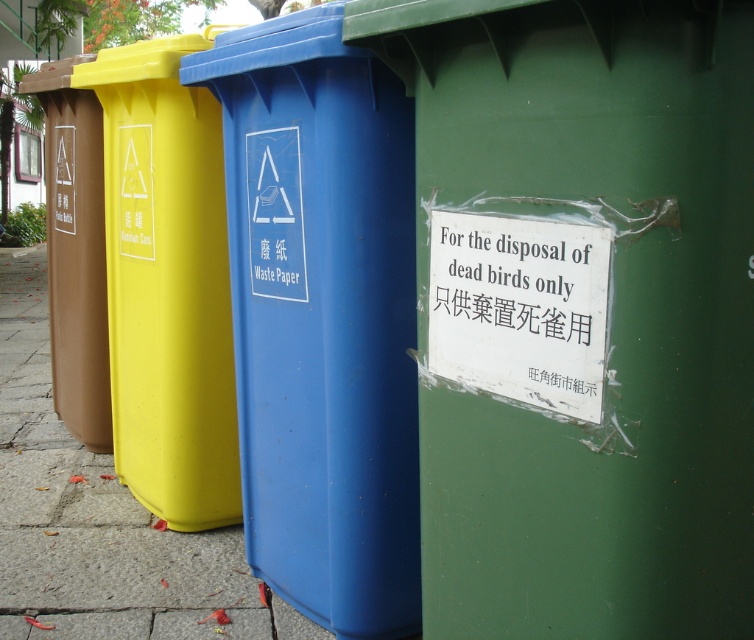
You are standing between the yellow plastic recycling bin at left and the green plastic recycling bin at right. The distance between them is important for a delivery robot that needs to pass through. Can the robot, which is 2.5 meters wide, fit through the space between them?

The distance between the yellow plastic recycling bin at left and the green plastic recycling bin at right is 2.66 meters, which is wider than the robot width of 2.5 meters. The robot can pass through the space between them.

You are standing on the matte concrete pavement at center and want to place a plastic bottle into the matte brown trash can at left. Can you do this without moving your feet?

The matte concrete pavement at center is positioned under the matte brown trash can at left, so yes, you can place the plastic bottle into the matte brown trash can at left without moving your feet since it is directly above you.

You are standing in front of the recycling area and see the blue plastic waste paper at center and the yellow plastic recycling bin at left. Which object is positioned lower in the image?

The blue plastic waste paper at center is positioned below the yellow plastic recycling bin at left, so it is lower in the image.